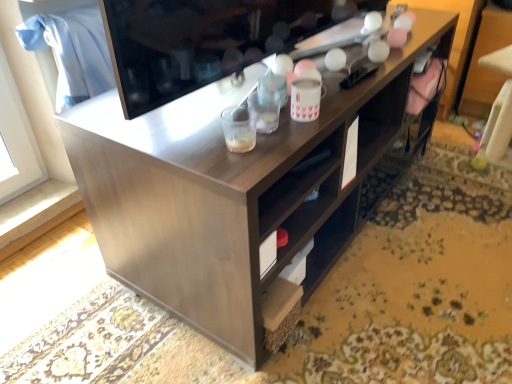
Find the location of a particular element. vacant space in front of translucent plastic cup at center, the second beverage when ordered from back to front is located at coordinates (241, 167).